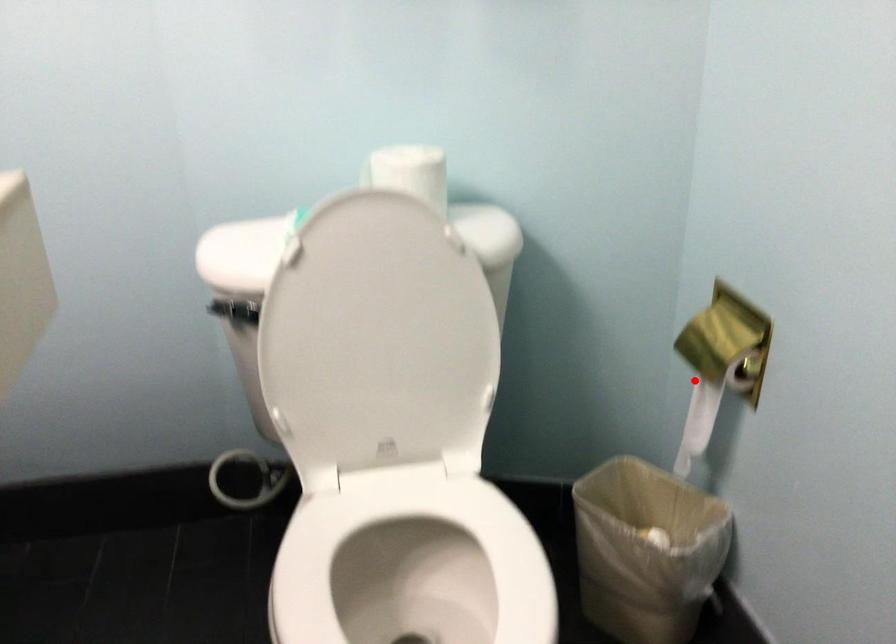
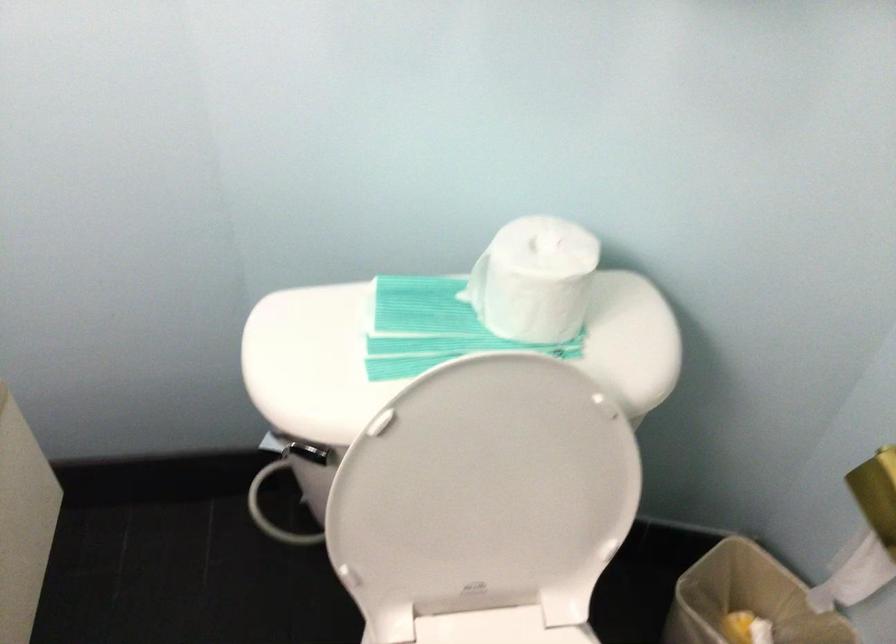
Question: A red point is marked in image1. In image2, is the corresponding 3D point closer to the camera or farther? Reply with the corresponding letter.

Choices:
 (A) The corresponding 3D point is closer.
 (B) The corresponding 3D point is farther.

Answer: (A)